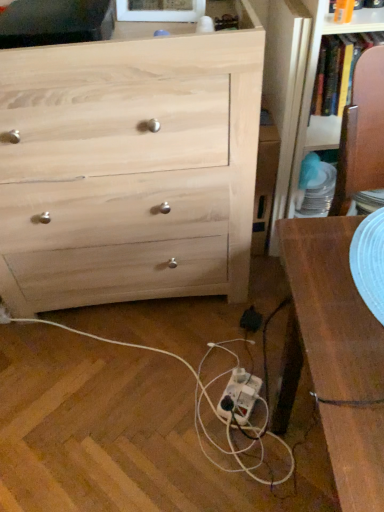
You are a GUI agent. You are given a task and a screenshot of the screen. Output one action in this format:
    pyautogui.click(x=<x>, y=<y>)
    Task: Click on the free space to the back side of white plastic extension cord at lower center
    This screenshot has height=512, width=384.
    Given the screenshot: What is the action you would take?
    pyautogui.click(x=230, y=350)